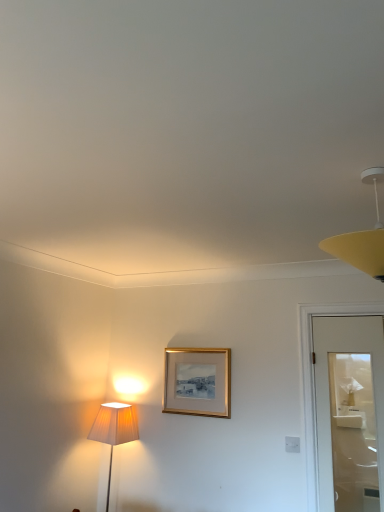
What do you see at coordinates (362, 238) in the screenshot? I see `yellow matte lampshade at upper right` at bounding box center [362, 238].

Where is `yellow matte lampshade at upper right`? This screenshot has width=384, height=512. yellow matte lampshade at upper right is located at coordinates (362, 238).

What is the approximate height of gold metallic picture frame at center?

gold metallic picture frame at center is 17.86 inches in height.

You are a GUI agent. You are given a task and a screenshot of the screen. Output one action in this format:
    pyautogui.click(x=<x>, y=<y>)
    Task: Click on the gold metallic picture frame at center
    
    Given the screenshot: What is the action you would take?
    pyautogui.click(x=198, y=381)

The height and width of the screenshot is (512, 384). What do you see at coordinates (198, 381) in the screenshot?
I see `gold metallic picture frame at center` at bounding box center [198, 381].

Identify the location of yellow matte lampshade at upper right. Image resolution: width=384 pixels, height=512 pixels. [362, 238].

Is yellow matte lampshade at upper right at the right side of gold metallic picture frame at center?

Yes, yellow matte lampshade at upper right is to the right of gold metallic picture frame at center.

In the image, is yellow matte lampshade at upper right positioned in front of or behind gold metallic picture frame at center?

In the image, yellow matte lampshade at upper right appears in front of gold metallic picture frame at center.

Does point (375, 201) appear closer or farther from the camera than point (165, 382)?

Point (375, 201) is positioned closer to the camera compared to point (165, 382).

From the image's perspective, is yellow matte lampshade at upper right located above gold metallic picture frame at center?

Correct, yellow matte lampshade at upper right appears higher than gold metallic picture frame at center in the image.

Based on the photo, from a real-world perspective, is yellow matte lampshade at upper right above or below gold metallic picture frame at center?

yellow matte lampshade at upper right is situated higher than gold metallic picture frame at center in the real world.

Considering the relative sizes of yellow matte lampshade at upper right and gold metallic picture frame at center in the image provided, is yellow matte lampshade at upper right wider than gold metallic picture frame at center?

Indeed, yellow matte lampshade at upper right has a greater width compared to gold metallic picture frame at center.

Can you confirm if yellow matte lampshade at upper right is taller than gold metallic picture frame at center?

Incorrect, the height of yellow matte lampshade at upper right is not larger of that of gold metallic picture frame at center.

Who is bigger, yellow matte lampshade at upper right or gold metallic picture frame at center?

With larger size is yellow matte lampshade at upper right.

Is yellow matte lampshade at upper right situated inside gold metallic picture frame at center or outside?

yellow matte lampshade at upper right exists outside the volume of gold metallic picture frame at center.

Can you see yellow matte lampshade at upper right touching gold metallic picture frame at center?

No, yellow matte lampshade at upper right is not touching gold metallic picture frame at center.

Is yellow matte lampshade at upper right oriented towards gold metallic picture frame at center?

No, yellow matte lampshade at upper right does not turn towards gold metallic picture frame at center.

How different are the orientations of yellow matte lampshade at upper right and gold metallic picture frame at center in degrees?

9.33 degrees.

The height and width of the screenshot is (512, 384). What are the coordinates of `lamp that is above the gold metallic picture frame at center (from the image's perspective)` in the screenshot? It's located at (362, 238).

Based on their positions, is gold metallic picture frame at center located to the left or right of yellow matte lampshade at upper right?

gold metallic picture frame at center is to the left of yellow matte lampshade at upper right.

Is gold metallic picture frame at center in front of or behind yellow matte lampshade at upper right in the image?

In the image, gold metallic picture frame at center appears behind yellow matte lampshade at upper right.

Does point (184, 413) come in front of point (338, 255)?

No, it is behind (338, 255).

From the image's perspective, is gold metallic picture frame at center positioned above or below yellow matte lampshade at upper right?

Clearly, from the image's perspective, gold metallic picture frame at center is below yellow matte lampshade at upper right.

From a real-world perspective, is gold metallic picture frame at center positioned over yellow matte lampshade at upper right based on gravity?

No, from a real-world perspective, gold metallic picture frame at center is not on top of yellow matte lampshade at upper right.

In the scene shown: Which of these two, gold metallic picture frame at center or yellow matte lampshade at upper right, is thinner?

gold metallic picture frame at center is thinner.

Is gold metallic picture frame at center shorter than yellow matte lampshade at upper right?

No.

Between gold metallic picture frame at center and yellow matte lampshade at upper right, which one has smaller size?

Smaller between the two is gold metallic picture frame at center.

Could yellow matte lampshade at upper right be considered to be inside gold metallic picture frame at center?

No, gold metallic picture frame at center does not contain yellow matte lampshade at upper right.

Are gold metallic picture frame at center and yellow matte lampshade at upper right beside each other?

gold metallic picture frame at center and yellow matte lampshade at upper right are not in contact.

Is gold metallic picture frame at center oriented towards yellow matte lampshade at upper right?

No, gold metallic picture frame at center does not turn towards yellow matte lampshade at upper right.

Where is `lamp in front of the gold metallic picture frame at center`? lamp in front of the gold metallic picture frame at center is located at coordinates (362, 238).

Find the location of a particular element. This screenshot has height=512, width=384. lamp in front of the gold metallic picture frame at center is located at coordinates (362, 238).

Identify the location of lamp that appears above the gold metallic picture frame at center (from the image's perspective). (362, 238).